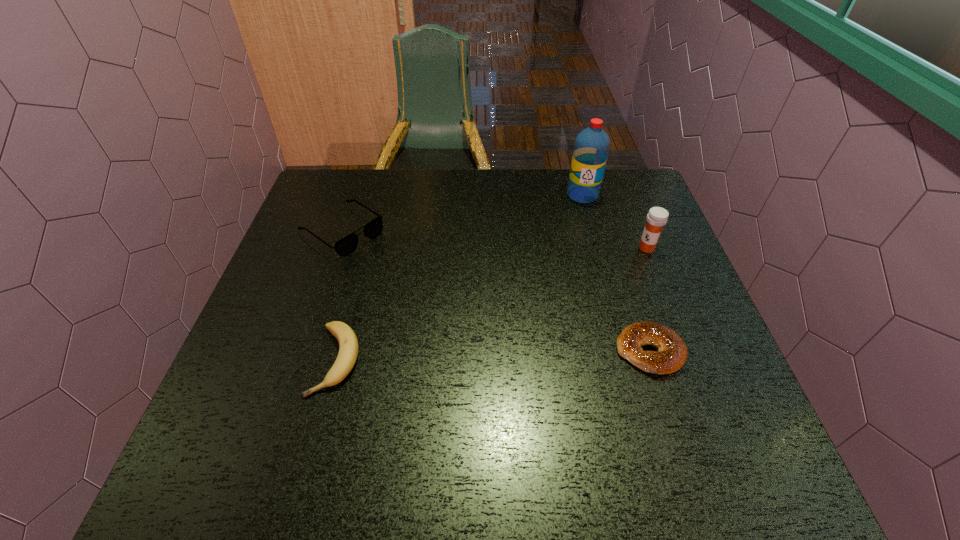
This screenshot has height=540, width=960. What are the coordinates of `free spot on the desktop that is between the banana and the bagel and is positioned on the front-facing side of the spectacles` in the screenshot? It's located at (522, 355).

Locate an element on the screen. The width and height of the screenshot is (960, 540). vacant space on the desktop that is between the banana and the bagel and is positioned on the label side of the fourth shortest object is located at coordinates (498, 355).

Identify the location of free spot on the desktop that is between the banana and the bagel and is positioned on the front label of the farthest object. This screenshot has width=960, height=540. (526, 355).